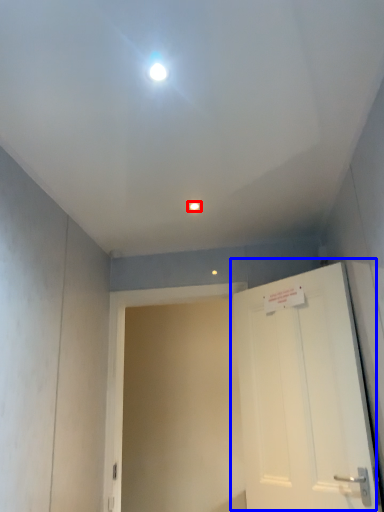
Question: Which of the following is the closest to the observer, light fixture (highlighted by a red box) or door (highlighted by a blue box)?

Choices:
 (A) light fixture
 (B) door

Answer: (B)